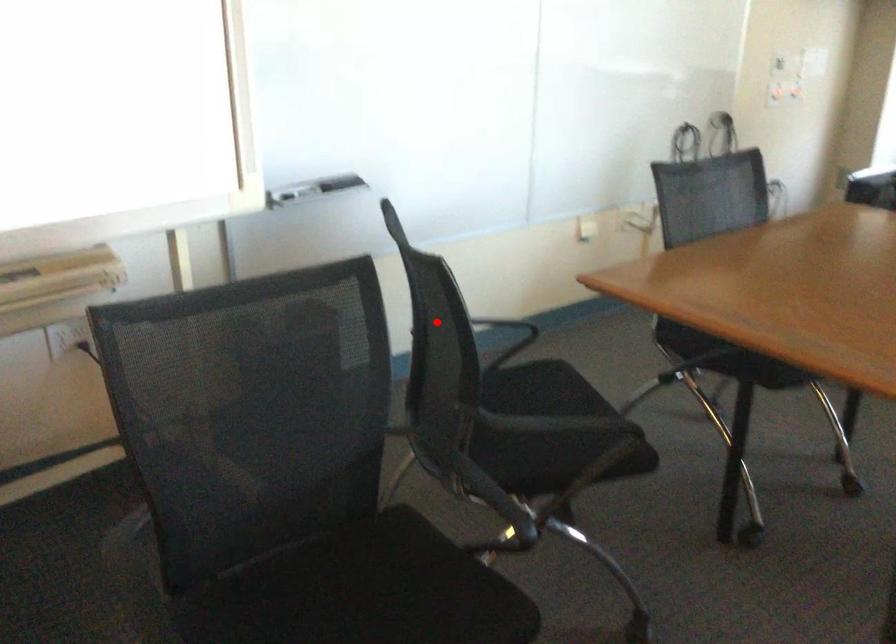
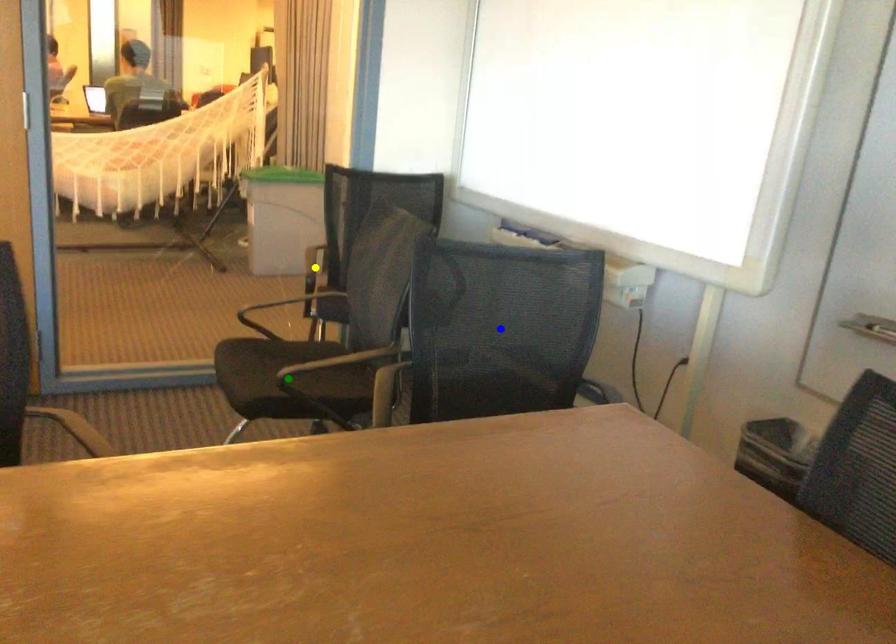
Question: I am providing you with two images of the same scene from different viewpoints. A red point is marked on the first image. You are given multiple points on the second image. In image 2, which mark is for the same physical point as the one in image 1?

Choices:
 (A) green point
 (B) blue point
 (C) yellow point

Answer: (B)